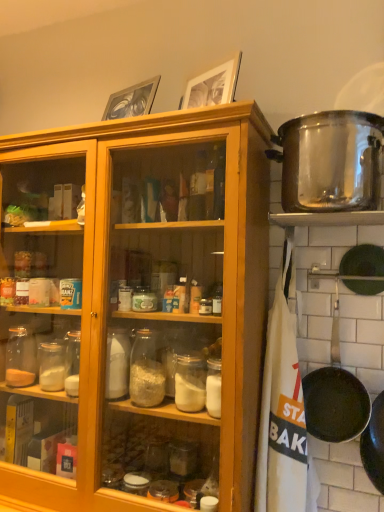
Question: Is stainless steel pot at upper right bigger or smaller than black non-stick frying pan at lower right?

Choices:
 (A) small
 (B) big

Answer: (B)

Question: In terms of height, does stainless steel pot at upper right look taller or shorter compared to black non-stick frying pan at lower right?

Choices:
 (A) short
 (B) tall

Answer: (A)

Question: From the image's perspective, relative to black non-stick frying pan at lower right, is stainless steel pot at upper right above or below?

Choices:
 (A) below
 (B) above

Answer: (B)

Question: Considering their positions, is black non-stick frying pan at lower right located in front of or behind stainless steel pot at upper right?

Choices:
 (A) front
 (B) behind

Answer: (B)

Question: Visually, is black non-stick frying pan at lower right positioned to the left or to the right of stainless steel pot at upper right?

Choices:
 (A) left
 (B) right

Answer: (B)

Question: Looking at the image, does black non-stick frying pan at lower right seem bigger or smaller compared to stainless steel pot at upper right?

Choices:
 (A) small
 (B) big

Answer: (A)

Question: Is black non-stick frying pan at lower right wider or thinner than stainless steel pot at upper right?

Choices:
 (A) thin
 (B) wide

Answer: (A)